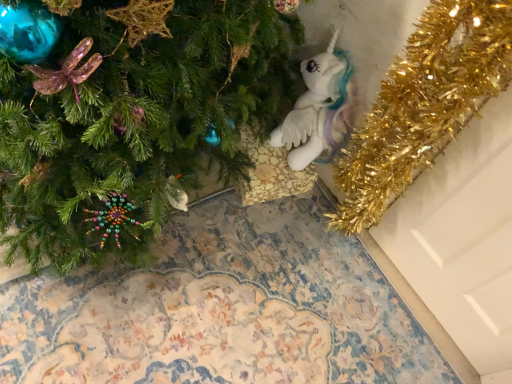
Question: In the image, is green matte christmas tree at lower left positioned in front of or behind white plush unicorn at center?

Choices:
 (A) front
 (B) behind

Answer: (A)

Question: Considering the positions of green matte christmas tree at lower left and white plush unicorn at center in the image, is green matte christmas tree at lower left taller or shorter than white plush unicorn at center?

Choices:
 (A) short
 (B) tall

Answer: (A)

Question: Is point (74, 195) positioned closer to the camera than point (309, 74)?

Choices:
 (A) farther
 (B) closer

Answer: (B)

Question: From the image's perspective, is white plush unicorn at center positioned above or below green matte christmas tree at lower left?

Choices:
 (A) above
 (B) below

Answer: (A)

Question: Is white plush unicorn at center to the left or to the right of green matte christmas tree at lower left in the image?

Choices:
 (A) left
 (B) right

Answer: (B)

Question: Based on their sizes in the image, would you say white plush unicorn at center is bigger or smaller than green matte christmas tree at lower left?

Choices:
 (A) big
 (B) small

Answer: (B)

Question: In terms of height, does white plush unicorn at center look taller or shorter compared to green matte christmas tree at lower left?

Choices:
 (A) short
 (B) tall

Answer: (B)